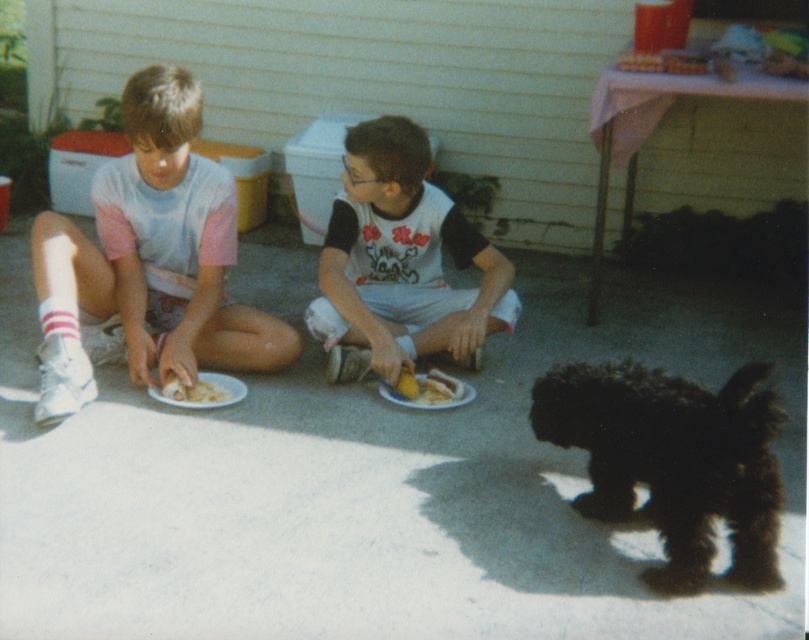
Question: Which object is positioned farthest from the white glossy plate at lower center?

Choices:
 (A) white cotton shirt at center
 (B) black fluffy dog at lower right

Answer: (B)

Question: Considering the real-world distances, which object is closest to the matte white shirt at left?

Choices:
 (A) white glossy plate at lower center
 (B) white cotton shirt at center
 (C) black fluffy dog at lower right

Answer: (B)

Question: Which point is farther to the camera?

Choices:
 (A) (339, 202)
 (B) (221, 330)

Answer: (A)

Question: In this image, where is matte white shirt at left located relative to yellow matte bread at lower left?

Choices:
 (A) left
 (B) right

Answer: (A)

Question: Does white cotton shirt at center have a greater width compared to yellow matte bread at lower left?

Choices:
 (A) yes
 (B) no

Answer: (A)

Question: Is black fluffy dog at lower right in front of white glossy plate at lower center?

Choices:
 (A) no
 (B) yes

Answer: (B)